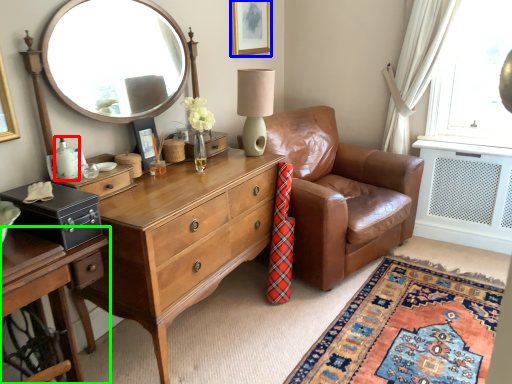
Question: Which object is the farthest from bottle (highlighted by a red box)? Choose among these: picture frame (highlighted by a blue box) or cabinetry (highlighted by a green box).

Choices:
 (A) picture frame
 (B) cabinetry

Answer: (A)